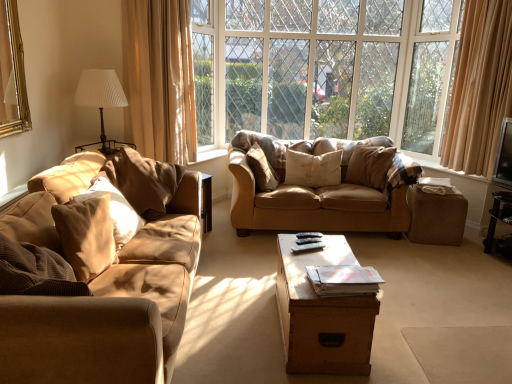
Question: Does metallic silver tv at right come behind clear glass window at center?

Choices:
 (A) yes
 (B) no

Answer: (B)

Question: Does metallic silver tv at right come in front of clear glass window at center?

Choices:
 (A) yes
 (B) no

Answer: (A)

Question: Is metallic silver tv at right in contact with clear glass window at center?

Choices:
 (A) yes
 (B) no

Answer: (B)

Question: Considering the relative positions of metallic silver tv at right and clear glass window at center in the image provided, is metallic silver tv at right to the right of clear glass window at center from the viewer's perspective?

Choices:
 (A) yes
 (B) no

Answer: (A)

Question: Considering the relative sizes of metallic silver tv at right and clear glass window at center in the image provided, is metallic silver tv at right thinner than clear glass window at center?

Choices:
 (A) no
 (B) yes

Answer: (A)

Question: Looking at the image, does white pleated fabric lampshade at upper left seem bigger or smaller compared to soft beige pillow at left, which is the second pillow from left to right?

Choices:
 (A) big
 (B) small

Answer: (A)

Question: Is white pleated fabric lampshade at upper left taller or shorter than soft beige pillow at left, acting as the 5th pillow starting from the right?

Choices:
 (A) short
 (B) tall

Answer: (B)

Question: From the image's perspective, is white pleated fabric lampshade at upper left located above or below soft beige pillow at left, acting as the 5th pillow starting from the right?

Choices:
 (A) above
 (B) below

Answer: (A)

Question: From a real-world perspective, is white pleated fabric lampshade at upper left positioned above or below soft beige pillow at left, acting as the 5th pillow starting from the right?

Choices:
 (A) below
 (B) above

Answer: (B)

Question: Is beige fabric curtain at upper left spatially inside clear glass window at center, or outside of it?

Choices:
 (A) inside
 (B) outside

Answer: (B)

Question: Based on their sizes in the image, would you say beige fabric curtain at upper left is bigger or smaller than clear glass window at center?

Choices:
 (A) small
 (B) big

Answer: (A)

Question: From the image's perspective, is beige fabric curtain at upper left above or below clear glass window at center?

Choices:
 (A) below
 (B) above

Answer: (A)

Question: From a real-world perspective, is beige fabric curtain at upper left above or below clear glass window at center?

Choices:
 (A) below
 (B) above

Answer: (A)

Question: In terms of width, does suede-like beige pillow at left, the sixth pillow in the right-to-left sequence, look wider or thinner when compared to suede-like beige pillow at center, which is counted as the second pillow, starting from the right?

Choices:
 (A) thin
 (B) wide

Answer: (B)

Question: From their relative heights in the image, would you say suede-like beige pillow at left, the sixth pillow in the right-to-left sequence, is taller or shorter than suede-like beige pillow at center, which is counted as the second pillow, starting from the right?

Choices:
 (A) tall
 (B) short

Answer: (A)